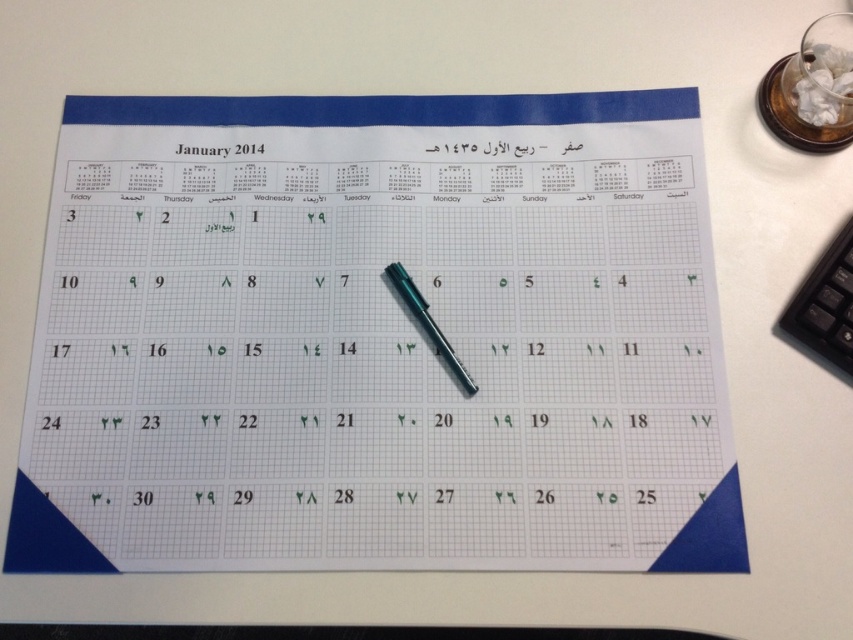
You are holding a black plastic calculator at right and want to place it back on the desk. The desk is 24 inches wide. Can you safely place it on the desk without overhanging the edge?

The black plastic calculator at right is 21.85 inches away from the viewer. Since the desk is 24 inches wide, there is enough space to place it safely without overhanging the edge.

You are organizing your desk and need to place a new item between the black plastic calculator at right and the green paper at center. Where should you place it?

You should place the new item between the black plastic calculator at right and the green paper at center, closer to the black plastic calculator at right since it is on the right side of the green paper at center.

You are standing in front of the calendar and want to place a sticker exactly halfway between the point at coordinates point [405,278] and point [247,499]. Which direction should you move from the first point to reach the halfway point?

To find the halfway point between point [405,278] and point [247,499], you should move towards the direction of point [247,499] from point [405,278]. The halfway point would be at coordinates calculated by averaging the x and y values of both points. However, since point [405,278] is closer to the viewer than point [247,499], moving towards it would require adjusting for depth perception to ensure accurate placement.